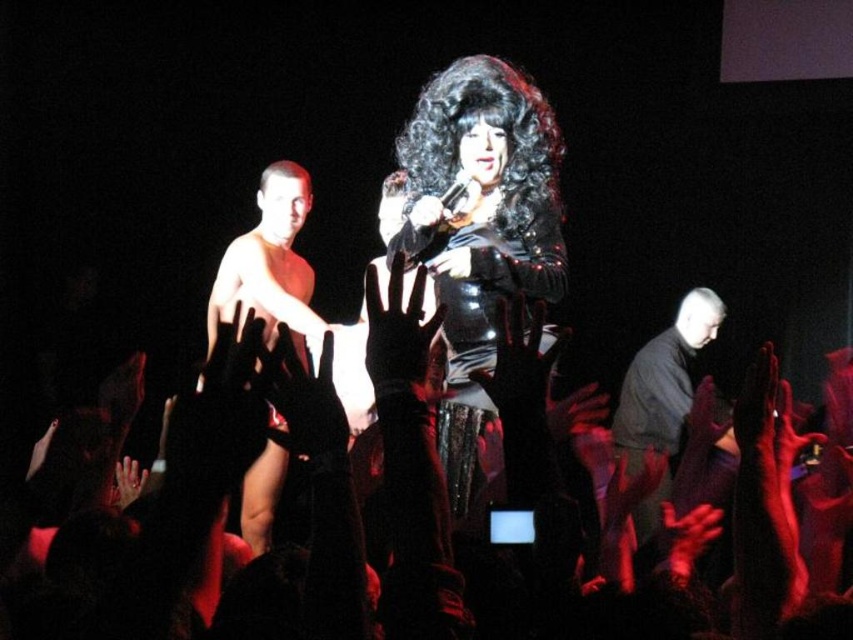
You are a photographer at the event and need to capture both the shiny black dress at center and the black matte shirt at lower right in a single frame. Which object should you focus on first to ensure both are in the frame?

The shiny black dress at center is smaller than the black matte shirt at lower right, so you should focus on the black matte shirt at lower right first to ensure both fit in the frame.

You are a photographer at the back of the venue and want to capture a clear photo of both the shiny black dress at center and the shiny skin torso at center in the same frame. Based on their positions, which object should you focus on first to ensure both are in focus?

Since the shiny black dress at center is wider than the shiny skin torso at center, you should focus on the shiny black dress at center first to ensure both are in focus.

You are sitting in the front row of the audience and want to toss a flower bouquet to the performer wearing the shiny black dress at center. If your throwing distance is 10 feet, will you be able to reach them?

The shiny black dress at center is 9.00 feet away from the viewer. Since your throwing distance is 10 feet, which is longer than the required 9.00 feet, you will be able to reach the performer wearing the shiny black dress at center with the flower bouquet.